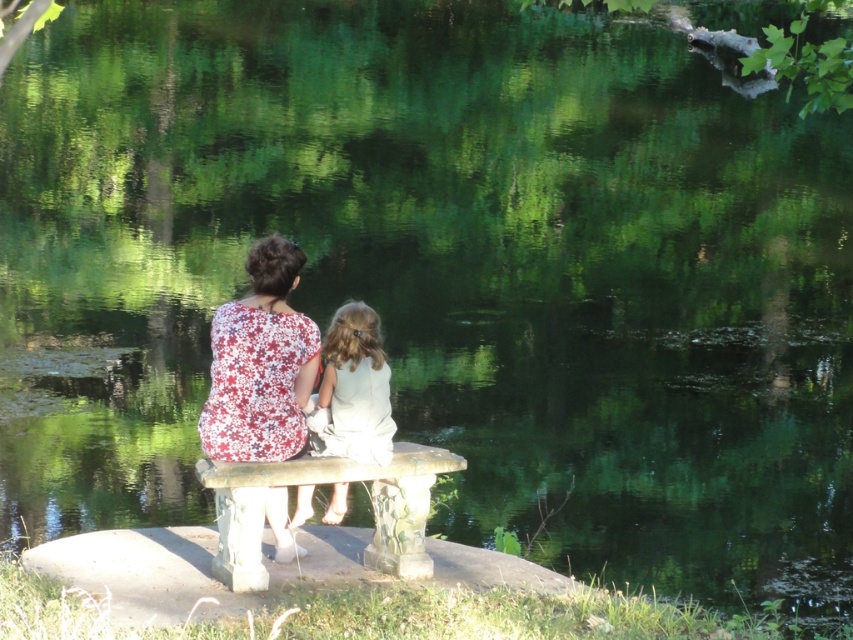
You are standing at the point labeled point (x=260, y=572) and want to walk towards the point labeled point (x=281, y=257). Which direction should you face to move directly towards it?

You should face west because point (x=281, y=257) is located to the west of point (x=260, y=572).

You are a photographer trying to capture a candid shot of the two people sitting on the stone bench. Since you don not want to disturb them, you need to position yourself in a way that allows you to see both the floral fabric blouse at center and the stone textured bench at center. Based on their positions, where should you position yourself relative to the subjects?

The stone textured bench at center is behind the floral fabric blouse at center, so to capture both subjects without being noticed, you should position yourself in front of the floral fabric blouse at center so that the bench is visible behind it.

You are a photographer trying to capture a photo of the two people sitting on the stone bench by the water. Since you want to ensure both the floral fabric blouse at center and the white satin dress at center are clearly visible in the frame, which clothing item will appear taller in the photograph?

The floral fabric blouse at center will appear taller in the photograph because it has a greater height compared to the white satin dress at center.